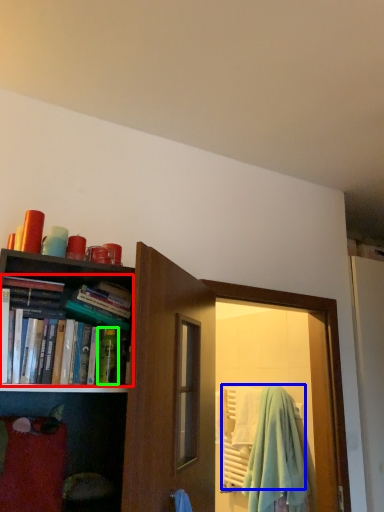
Question: Based on their relative distances, which object is nearer to book (highlighted by a red box)? Choose from beach towel (highlighted by a blue box) and toiletry (highlighted by a green box).

Choices:
 (A) beach towel
 (B) toiletry

Answer: (B)